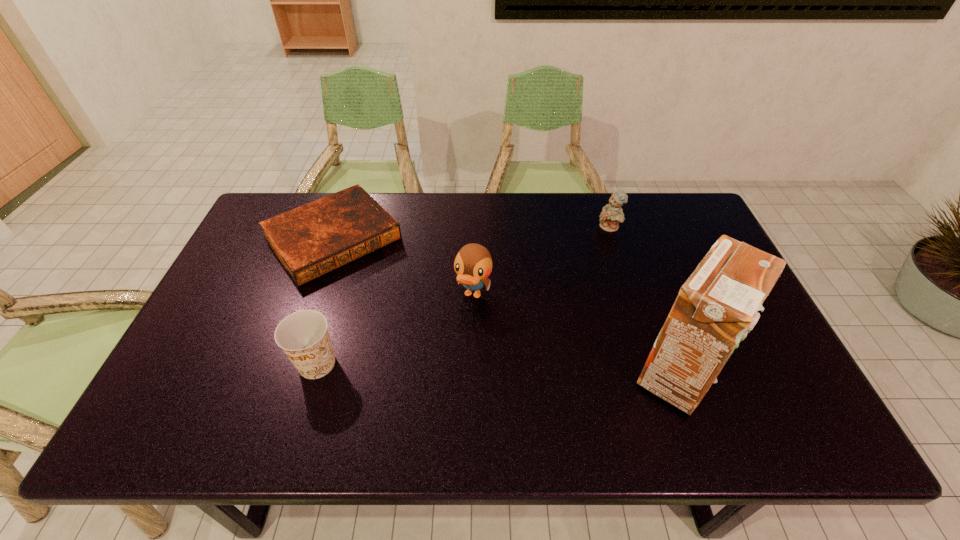
Locate an element on the screen. Image resolution: width=960 pixels, height=540 pixels. free space on the desktop that is between the Dixie cup and the carton and is positioned on the front-facing side of the teddy bear is located at coordinates (501, 369).

Locate an element on the screen. The width and height of the screenshot is (960, 540). vacant space on the desktop that is between the Dixie cup and the tallest object and is positioned on the spine side of the Bible is located at coordinates (443, 368).

The image size is (960, 540). What are the coordinates of `free space on the desktop that is between the Dixie cup and the carton and is positioned on the front-facing side of the third object from right to left` in the screenshot? It's located at (444, 368).